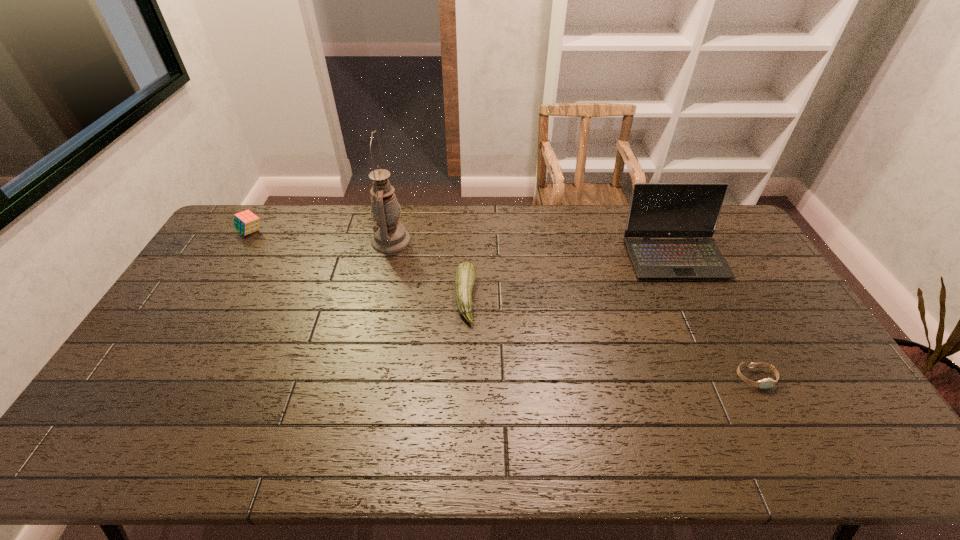
Where is `object located in the far right corner section of the desktop`? The image size is (960, 540). object located in the far right corner section of the desktop is located at coordinates (657, 210).

The image size is (960, 540). In the image, there is a desktop. Find the location of `vacant region at the far edge`. vacant region at the far edge is located at coordinates (489, 216).

You are a GUI agent. You are given a task and a screenshot of the screen. Output one action in this format:
    pyautogui.click(x=<x>, y=<y>)
    Task: Click on the vacant space at the near edge
    
    Given the screenshot: What is the action you would take?
    pyautogui.click(x=588, y=435)

What are the coordinates of `free spot at the right edge of the desktop` in the screenshot? It's located at (790, 310).

Identify the location of free space at the far left corner of the desktop. The image size is (960, 540). (243, 238).

Where is `vacant space that's between the nearest object and the cube`? Image resolution: width=960 pixels, height=540 pixels. vacant space that's between the nearest object and the cube is located at coordinates (503, 305).

Locate an element on the screen. The width and height of the screenshot is (960, 540). empty space that is in between the leftmost object and the watch is located at coordinates (503, 305).

Locate an element on the screen. Image resolution: width=960 pixels, height=540 pixels. free space between the third object from right to left and the fourth shortest object is located at coordinates coord(569,277).

Find the location of a particular element. The height and width of the screenshot is (540, 960). free space between the cube and the shortest object is located at coordinates [503, 305].

Locate an element on the screen. The width and height of the screenshot is (960, 540). free space between the watch and the laptop computer is located at coordinates (714, 317).